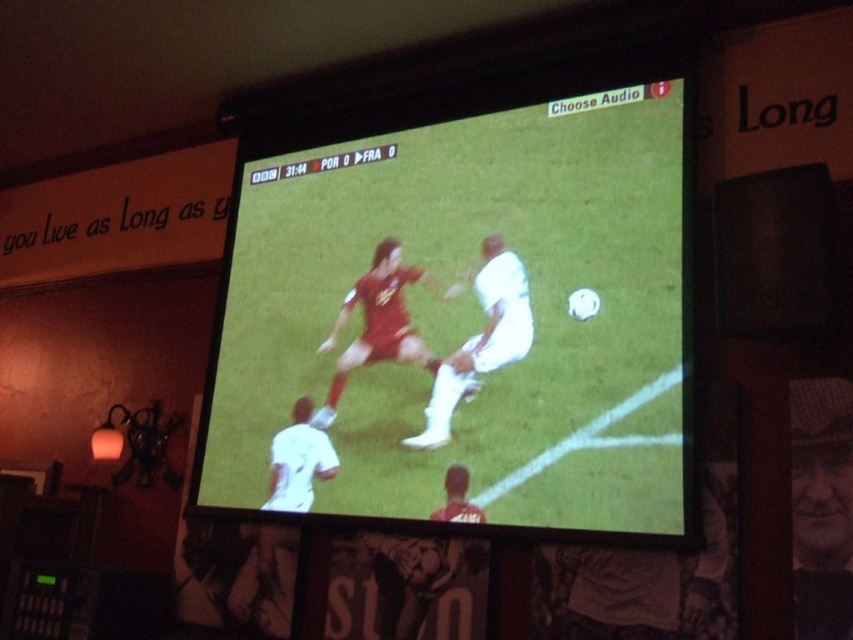
You are a delivery person who needs to place a small package on the exact location of point (798, 609) in the room. The package is 1 foot in length. Can you fit the package horizontally at that spot without it overlapping with any objects?

The distance from point (798, 609) to the camera is 6.47 feet. Since the package is only 1 foot long, there is sufficient space to place it horizontally at that location without overlapping any objects.

You are a sports fan trying to identify the players in the soccer match on the TV screen. You notice a smooth leather hat at upper right and a white matte jersey at lower left. Which object is located higher on the screen?

The smooth leather hat at upper right is positioned over the white matte jersey at lower left, so it is higher on the screen.